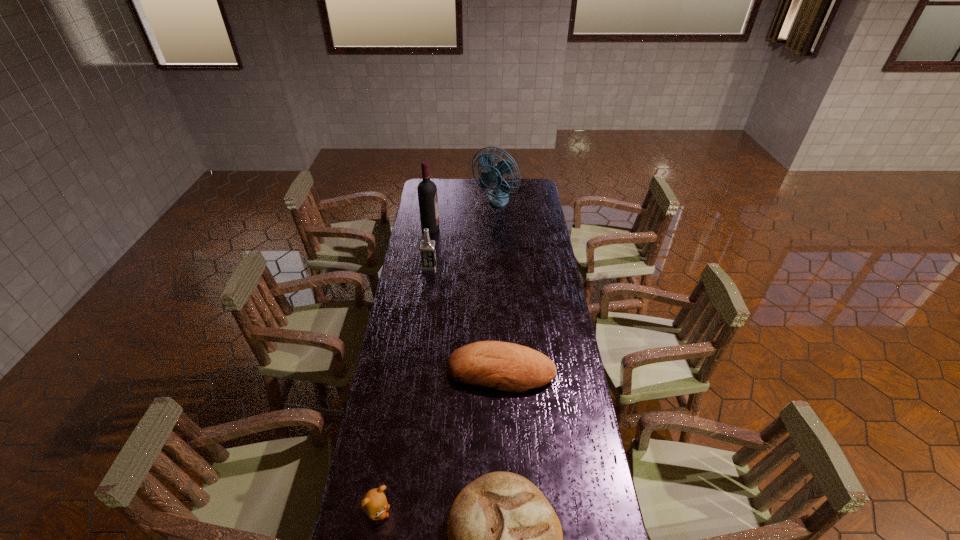
At what (x,y) coordinates should I click in order to perform the action: click on vacant area located on the face of the teddy bear. Please return your answer as a coordinate pair (x, y). This screenshot has width=960, height=540. Looking at the image, I should click on (456, 513).

Locate an element on the screen. The image size is (960, 540). vacant area located 0.300m on the back of the farther bread is located at coordinates (497, 297).

Identify the location of object that is at the far edge. (498, 197).

Identify the location of wine bottle present at the left edge. This screenshot has width=960, height=540. (427, 190).

Identify the location of vodka that is at the left edge. This screenshot has width=960, height=540. (427, 247).

Locate an element on the screen. The image size is (960, 540). teddy bear at the left edge is located at coordinates (374, 503).

Where is `fan at the right edge`? fan at the right edge is located at coordinates (498, 197).

This screenshot has height=540, width=960. I want to click on bread that is at the right edge, so click(504, 366).

Find the location of a particular element. object situated at the far right corner is located at coordinates (498, 197).

Where is `free region at the far edge of the desktop`? The height and width of the screenshot is (540, 960). free region at the far edge of the desktop is located at coordinates (463, 197).